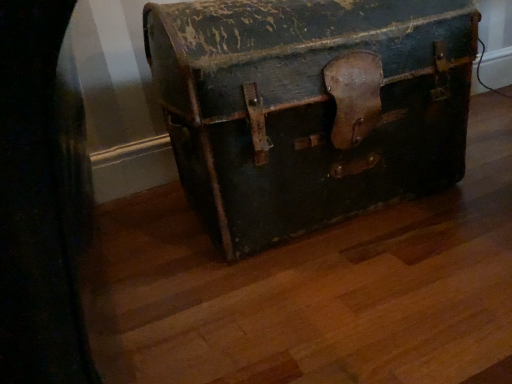
The image size is (512, 384). I want to click on green leather suitcase at center, so click(x=309, y=107).

Measure the distance between point (268, 186) and camera.

Point (268, 186) and camera are 97.70 centimeters apart from each other.

Image resolution: width=512 pixels, height=384 pixels. Describe the element at coordinates (309, 107) in the screenshot. I see `green leather suitcase at center` at that location.

You are a GUI agent. You are given a task and a screenshot of the screen. Output one action in this format:
    pyautogui.click(x=<x>, y=<y>)
    Task: Click on the green leather suitcase at center
    The image size is (512, 384).
    Given the screenshot: What is the action you would take?
    pyautogui.click(x=309, y=107)